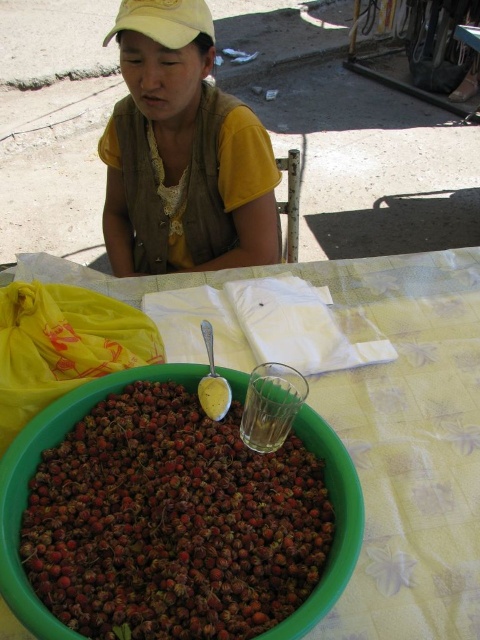
You are setting up a table for a small gathering and want to ensure there is enough space for both the red matte berries at center and the yellow fabric at center. Based on the scene, which object takes up more space on the table?

The yellow fabric at center occupies more space than the red matte berries at center, as the red matte berries at center occupies less space than yellow fabric at center.

You are setting up a display for a summer event and have a red matte berries at center and a yellow fabric at center. According to the scene, which object is closer to the viewer?

The red matte berries at center is closer to the viewer as it is in front of the yellow fabric at center.